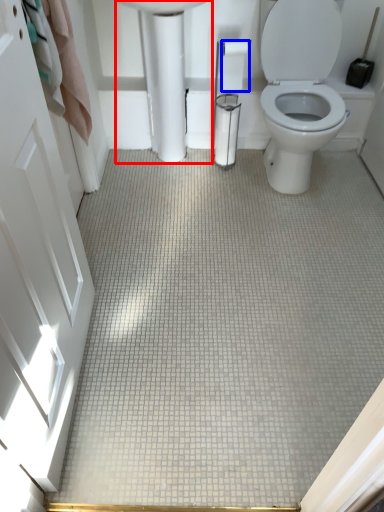
Question: Which object appears closest to the camera in this image, porcelain (highlighted by a red box) or toilet paper (highlighted by a blue box)?

Choices:
 (A) porcelain
 (B) toilet paper

Answer: (A)